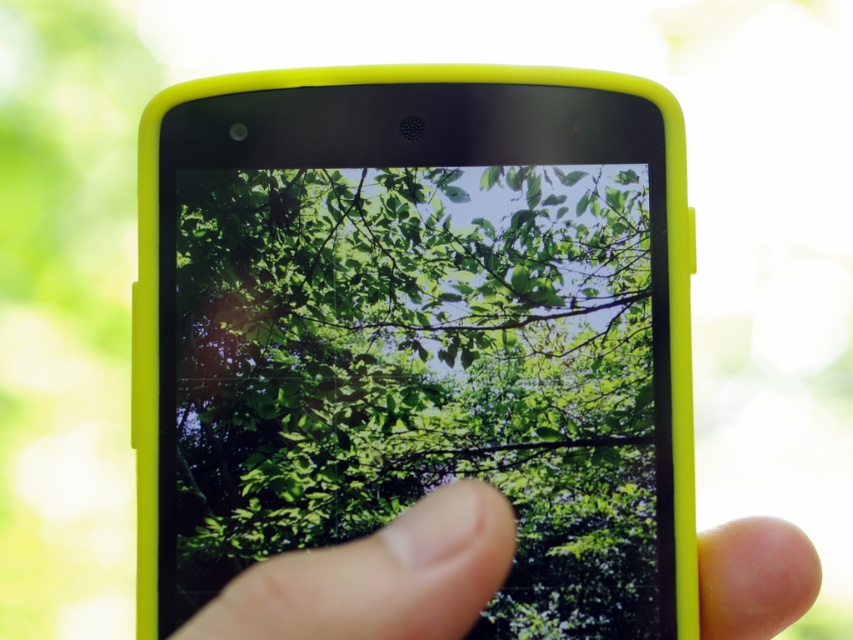
You are trying to take a selfie with your phone. The green leafy tree at center and finger at center are currently 3.59 inches apart. If your face is 12 inches away from the phone, will the tree and your finger both be in focus?

The green leafy tree at center and finger at center are 3.59 inches apart. Since your face is 12 inches away from the phone, the tree and your finger are within the depth of field, so both will be in focus.

You are trying to take a selfie with your smartphone. The screen shows a photo with the green leafy tree at center and your finger at center. If you want to frame the tree properly, should you move your finger up or down?

The green leafy tree at center is taller than the finger at center. To frame the tree properly, you should move your finger down so it doesn t block the top of the tree.

You are trying to take a photo of the green leafy tree at center and the finger at center. Which one is positioned to the left side in the image?

The green leafy tree at center is to the left of the finger at center in the image.